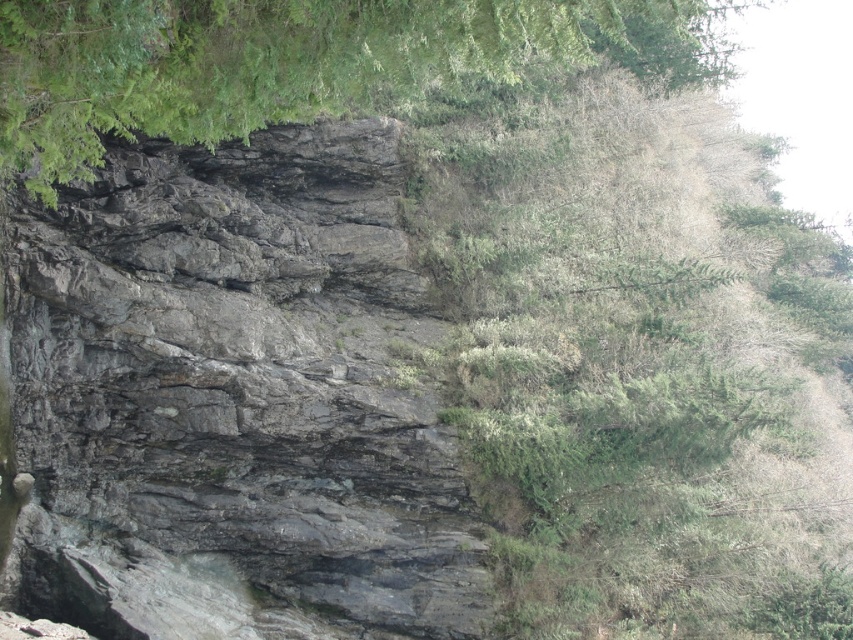
You are a hiker trying to navigate between the gray rock at center and the green leafy tree at upper center. Which object takes up more space in the image?

The green leafy tree at upper center occupies more space than the gray rock at center.

From the picture: You are a hiker who wants to place a 4 meter long ladder between the gray rock at center and the green leafy tree at upper center. Will the ladder fit between them?

The distance between the gray rock at center and the green leafy tree at upper center is 4.15 meters, so a 4 meter long ladder will fit between them since it is shorter than the available space.